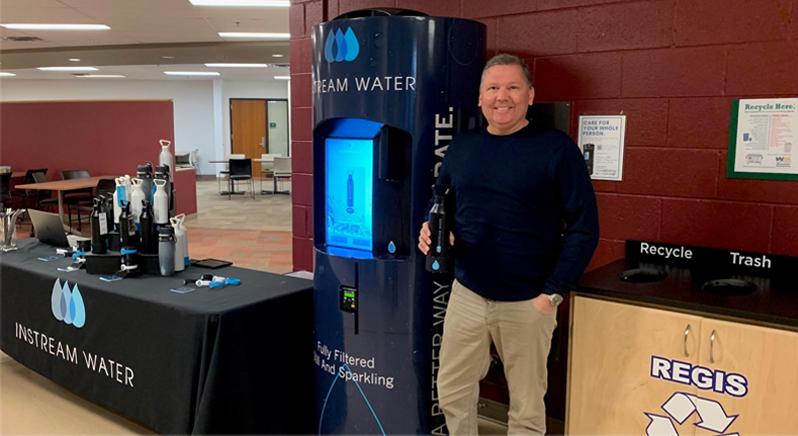
This screenshot has width=798, height=436. Identify the location of ceiling lights. (247, 31), (192, 73), (245, 63), (65, 26).